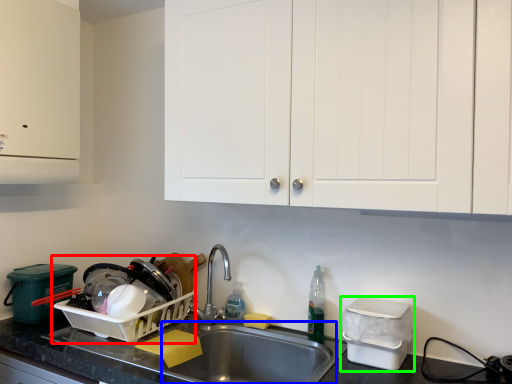
Question: Which object is the closest to the appliance (highlighted by a red box)? Choose among these: sink (highlighted by a blue box) or appliance (highlighted by a green box).

Choices:
 (A) sink
 (B) appliance

Answer: (A)